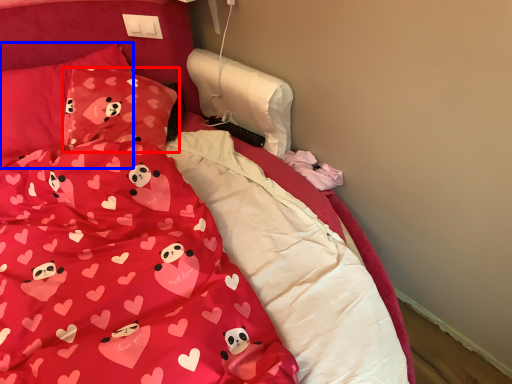
Question: Which point is closer to the camera, pillow (highlighted by a red box) or pillow (highlighted by a blue box)?

Choices:
 (A) pillow
 (B) pillow

Answer: (A)